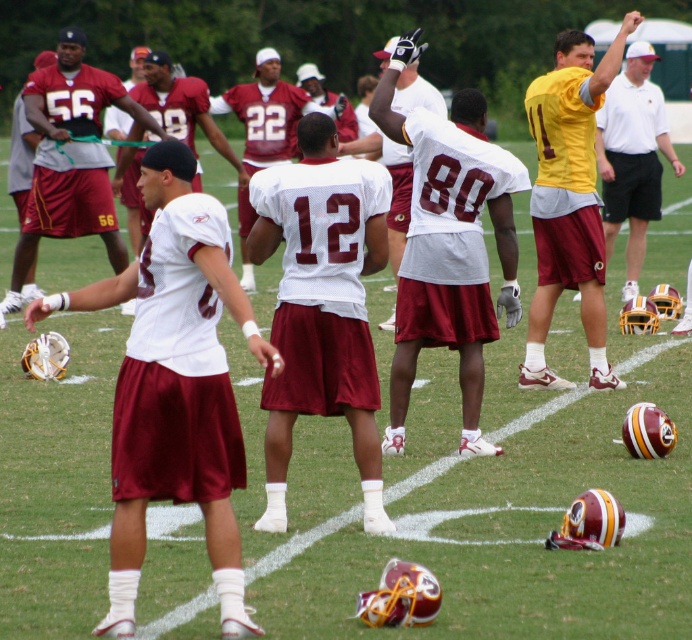
You are a photographer positioned at the edge of the field. You want to capture a photo that includes both the yellow jersey at upper right and the maroon satin jersey at center. Based on their positions, which jersey will appear closer to the camera in the photo?

The yellow jersey at upper right will appear closer to the camera in the photo because it is positioned in front of the maroon satin jersey at center.

You are a photographer positioned at the center of the field. You notice a specific point marked at coordinates (320, 304). Based on the scene, can you identify what object or feature this point is located on?

The point at coordinates (320, 304) is on the white mesh jersey at center.